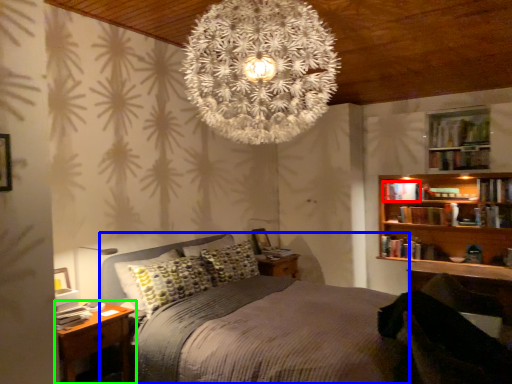
Question: Estimate the real-world distances between objects in this image. Which object is farther from book (highlighted by a red box), bed (highlighted by a blue box) or nightstand (highlighted by a green box)?

Choices:
 (A) bed
 (B) nightstand

Answer: (B)